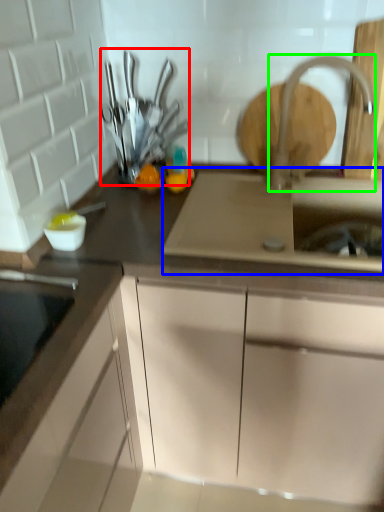
Question: Based on their relative distances, which object is farther from tableware (highlighted by a red box)? Choose from sink (highlighted by a blue box) and tap (highlighted by a green box).

Choices:
 (A) sink
 (B) tap

Answer: (B)